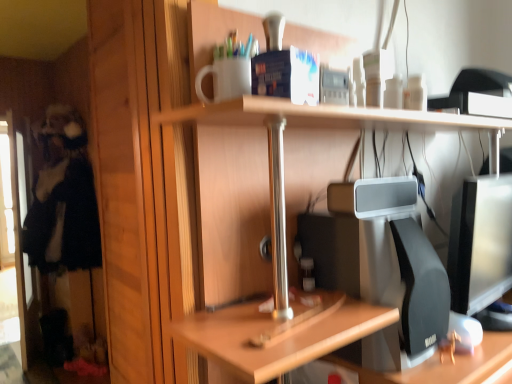
Question: Is black plush toy at left surrounding transparent glass screen door at left?

Choices:
 (A) no
 (B) yes

Answer: (B)

Question: Is black plush toy at left at the left side of transparent glass screen door at left?

Choices:
 (A) yes
 (B) no

Answer: (B)

Question: Could you tell me if black plush toy at left is facing transparent glass screen door at left?

Choices:
 (A) yes
 (B) no

Answer: (A)

Question: Considering the relative sizes of black plush toy at left and transparent glass screen door at left in the image provided, is black plush toy at left thinner than transparent glass screen door at left?

Choices:
 (A) no
 (B) yes

Answer: (A)

Question: Is black plush toy at left behind transparent glass screen door at left?

Choices:
 (A) no
 (B) yes

Answer: (A)

Question: Can you confirm if black plush toy at left is shorter than transparent glass screen door at left?

Choices:
 (A) yes
 (B) no

Answer: (A)

Question: Is transparent glass screen door at left at the left side of black plush toy at left?

Choices:
 (A) no
 (B) yes

Answer: (B)

Question: From the image's perspective, is transparent glass screen door at left below black plush toy at left?

Choices:
 (A) no
 (B) yes

Answer: (B)

Question: Considering the relative positions of transparent glass screen door at left and black plush toy at left in the image provided, is transparent glass screen door at left in front of black plush toy at left?

Choices:
 (A) no
 (B) yes

Answer: (A)

Question: From a real-world perspective, does transparent glass screen door at left sit lower than black plush toy at left?

Choices:
 (A) no
 (B) yes

Answer: (B)

Question: Is transparent glass screen door at left looking in the opposite direction of black plush toy at left?

Choices:
 (A) yes
 (B) no

Answer: (A)

Question: Is transparent glass screen door at left thinner than black plush toy at left?

Choices:
 (A) no
 (B) yes

Answer: (B)

Question: Looking at their shapes, would you say transparent glass screen door at left is wider or thinner than black plush toy at left?

Choices:
 (A) wide
 (B) thin

Answer: (B)